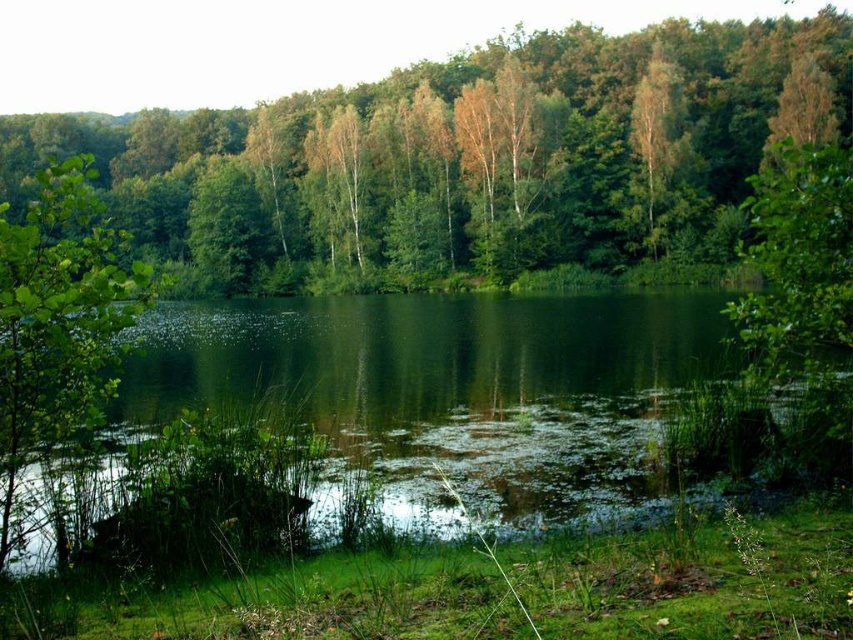
Question: Which is nearer to the green leafy tree at center?

Choices:
 (A) green liquid at center
 (B) green leafy tree at left

Answer: (B)

Question: Which of these objects is positioned closest to the green leafy tree at left?

Choices:
 (A) green leafy tree at center
 (B) green liquid at center

Answer: (B)

Question: Observing the image, what is the correct spatial positioning of green leafy tree at center in reference to green liquid at center?

Choices:
 (A) right
 (B) left

Answer: (B)

Question: Is green leafy tree at center closer to the viewer compared to green liquid at center?

Choices:
 (A) yes
 (B) no

Answer: (A)

Question: Does green leafy tree at center have a lesser width compared to green leafy tree at left?

Choices:
 (A) no
 (B) yes

Answer: (A)

Question: Considering the real-world distances, which object is closest to the green leafy tree at center?

Choices:
 (A) green leafy tree at left
 (B) green liquid at center

Answer: (A)